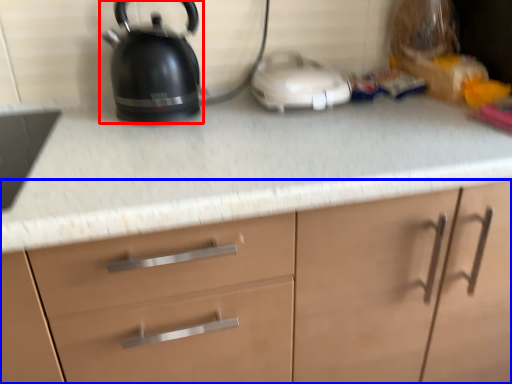
Question: Among these objects, which one is farthest to the camera, kettle (highlighted by a red box) or cabinetry (highlighted by a blue box)?

Choices:
 (A) kettle
 (B) cabinetry

Answer: (A)